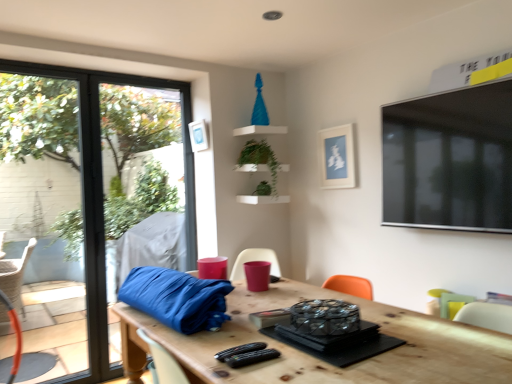
Question: Is green matte plant at upper center, marked as the first plant in a top-to-bottom arrangement, shorter than wooden table at center?

Choices:
 (A) no
 (B) yes

Answer: (B)

Question: Can you confirm if green matte plant at upper center, which appears as the 2th plant when ordered from the bottom, is thinner than wooden table at center?

Choices:
 (A) yes
 (B) no

Answer: (A)

Question: From the image's perspective, is green matte plant at upper center, marked as the first plant in a top-to-bottom arrangement, on top of wooden table at center?

Choices:
 (A) no
 (B) yes

Answer: (B)

Question: Are green matte plant at upper center, marked as the first plant in a top-to-bottom arrangement, and wooden table at center making contact?

Choices:
 (A) yes
 (B) no

Answer: (B)

Question: Considering the relative sizes of green matte plant at upper center, marked as the first plant in a top-to-bottom arrangement, and wooden table at center in the image provided, is green matte plant at upper center, marked as the first plant in a top-to-bottom arrangement, taller than wooden table at center?

Choices:
 (A) no
 (B) yes

Answer: (A)

Question: Considering the relative positions of wooden table at center and green matte plant at upper center, marked as the first plant in a top-to-bottom arrangement, in the image provided, is wooden table at center to the left or to the right of green matte plant at upper center, marked as the first plant in a top-to-bottom arrangement,?

Choices:
 (A) left
 (B) right

Answer: (B)

Question: Is wooden table at center taller or shorter than green matte plant at upper center, which appears as the 2th plant when ordered from the bottom?

Choices:
 (A) tall
 (B) short

Answer: (A)

Question: Looking at their shapes, would you say wooden table at center is wider or thinner than green matte plant at upper center, marked as the first plant in a top-to-bottom arrangement?

Choices:
 (A) wide
 (B) thin

Answer: (A)

Question: From a real-world perspective, is wooden table at center physically located above or below green matte plant at upper center, marked as the first plant in a top-to-bottom arrangement?

Choices:
 (A) above
 (B) below

Answer: (B)

Question: Does point (193, 150) appear closer or farther from the camera than point (264, 182)?

Choices:
 (A) closer
 (B) farther

Answer: (B)

Question: In terms of size, does white matte picture frame at upper center, marked as the first picture frame in a left-to-right arrangement, appear bigger or smaller than green leafy plant at upper center, positioned as the second plant in top-to-bottom order?

Choices:
 (A) small
 (B) big

Answer: (B)

Question: Considering the positions of white matte picture frame at upper center, marked as the first picture frame in a left-to-right arrangement, and green leafy plant at upper center, which is the 1th plant in bottom-to-top order, in the image, is white matte picture frame at upper center, marked as the first picture frame in a left-to-right arrangement, wider or thinner than green leafy plant at upper center, which is the 1th plant in bottom-to-top order,?

Choices:
 (A) thin
 (B) wide

Answer: (A)

Question: Is white matte picture frame at upper center, positioned as the second picture frame in right-to-left order, in front of or behind green leafy plant at upper center, positioned as the second plant in top-to-bottom order, in the image?

Choices:
 (A) behind
 (B) front

Answer: (B)

Question: From a real-world perspective, is pastel green fabric armchair at lower right, the 1th armchair ordered from the bottom, above or below white matte picture frame at upper center, the second picture frame in the left-to-right sequence?

Choices:
 (A) below
 (B) above

Answer: (A)

Question: Based on their positions, is pastel green fabric armchair at lower right, the 1th armchair when ordered from right to left, located to the left or right of white matte picture frame at upper center, the second picture frame in the left-to-right sequence?

Choices:
 (A) right
 (B) left

Answer: (A)